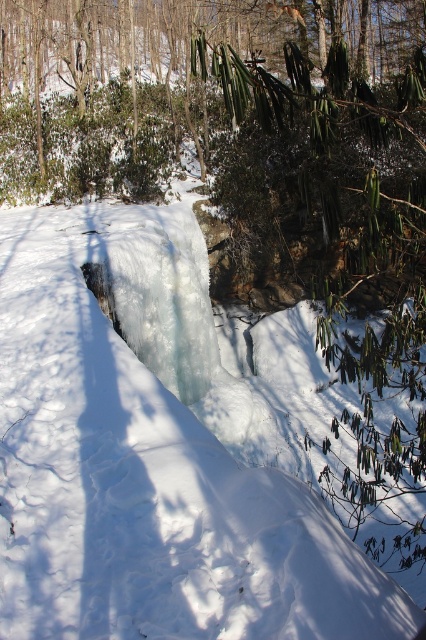
You are a hiker with a 2 meter long ice axe. You are standing at the edge of the white frosty snow at center and want to reach the waterfall. Can you reach the waterfall with your ice axe without moving from your current position?

The distance between the white frosty snow at center and the waterfall is 2.13 meters. Since your ice axe is only 2 meters long, you cannot reach the waterfall without moving closer.

You are standing at the point marked by point [150,456] in the winter scene. Looking around, you see the white frosty snow at center. Which direction should you move to reach the waterfall?

The waterfall is to the left of the white frosty snow at center, so you should move to the left to reach it.